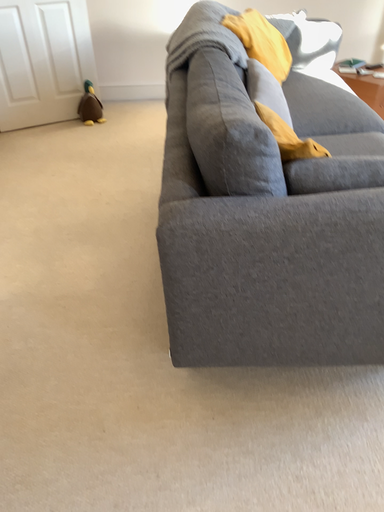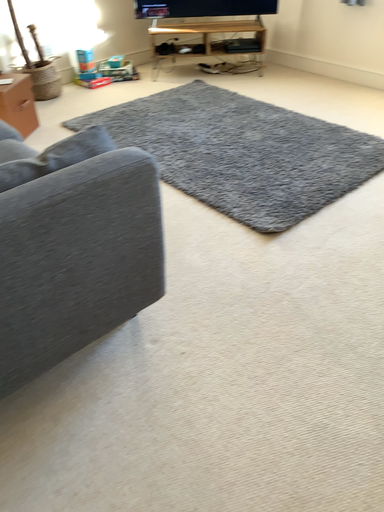
Question: Which way did the camera rotate in the video?

Choices:
 (A) rotated downward
 (B) rotated upward

Answer: (B)